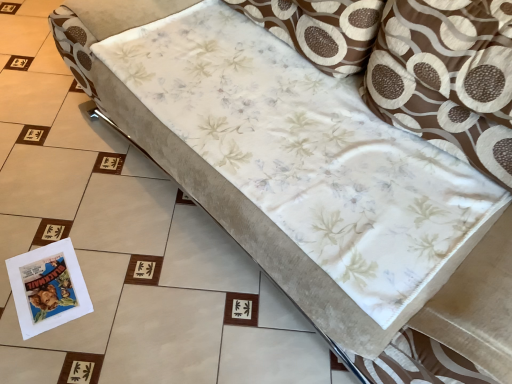
Describe the element at coordinates (447, 78) in the screenshot. I see `floral fabric pillow at upper right` at that location.

Measure the distance between floral fabric pillow at upper right and camera.

floral fabric pillow at upper right and camera are 1.08 meters apart.

You are a GUI agent. You are given a task and a screenshot of the screen. Output one action in this format:
    pyautogui.click(x=<x>, y=<y>)
    Task: Click on the floral fabric pillow at upper right
    The image size is (512, 384).
    Given the screenshot: What is the action you would take?
    pyautogui.click(x=447, y=78)

The image size is (512, 384). Identify the location of brown textured pillow at upper right. (320, 29).

What do you see at coordinates (320, 29) in the screenshot? This screenshot has width=512, height=384. I see `brown textured pillow at upper right` at bounding box center [320, 29].

You are a GUI agent. You are given a task and a screenshot of the screen. Output one action in this format:
    pyautogui.click(x=<x>, y=<y>)
    Task: Click on the floral fabric pillow at upper right
    The width and height of the screenshot is (512, 384).
    Given the screenshot: What is the action you would take?
    pyautogui.click(x=447, y=78)

Based on their positions, is brown textured pillow at upper right located to the left or right of floral fabric pillow at upper right?

Based on their positions, brown textured pillow at upper right is located to the left of floral fabric pillow at upper right.

Is brown textured pillow at upper right positioned in front of floral fabric pillow at upper right?

No, it is not.

Considering the points (342, 45) and (406, 57), which point is in front, point (342, 45) or point (406, 57)?

Positioned in front is point (406, 57).

Consider the image. From the image's perspective, between brown textured pillow at upper right and floral fabric pillow at upper right, which one is located above?

brown textured pillow at upper right, from the image's perspective.

From a real-world perspective, relative to floral fabric pillow at upper right, is brown textured pillow at upper right vertically above or below?

Clearly, from a real-world perspective, brown textured pillow at upper right is below floral fabric pillow at upper right.

Which of these two, brown textured pillow at upper right or floral fabric pillow at upper right, is thinner?

Thinner between the two is brown textured pillow at upper right.

Does brown textured pillow at upper right have a greater height compared to floral fabric pillow at upper right?

In fact, brown textured pillow at upper right may be shorter than floral fabric pillow at upper right.

Considering the sizes of objects brown textured pillow at upper right and floral fabric pillow at upper right in the image provided, who is bigger, brown textured pillow at upper right or floral fabric pillow at upper right?

floral fabric pillow at upper right.

Is brown textured pillow at upper right outside of floral fabric pillow at upper right?

Yes, brown textured pillow at upper right is located beyond the bounds of floral fabric pillow at upper right.

Is brown textured pillow at upper right far away from floral fabric pillow at upper right?

brown textured pillow at upper right is actually quite close to floral fabric pillow at upper right.

Is brown textured pillow at upper right positioned with its back to floral fabric pillow at upper right?

brown textured pillow at upper right is not turned away from floral fabric pillow at upper right.

Image resolution: width=512 pixels, height=384 pixels. I want to click on throw pillow in front of the brown textured pillow at upper right, so click(x=447, y=78).

Which is more to the right, floral fabric pillow at upper right or brown textured pillow at upper right?

From the viewer's perspective, floral fabric pillow at upper right appears more on the right side.

Does floral fabric pillow at upper right come in front of brown textured pillow at upper right?

Yes, floral fabric pillow at upper right is in front of brown textured pillow at upper right.

Is point (472, 74) positioned before point (307, 37)?

That is True.

From the image's perspective, is floral fabric pillow at upper right over brown textured pillow at upper right?

Actually, floral fabric pillow at upper right appears below brown textured pillow at upper right in the image.

From a real-world perspective, is floral fabric pillow at upper right positioned under brown textured pillow at upper right based on gravity?

Incorrect, from a real-world perspective, floral fabric pillow at upper right is higher than brown textured pillow at upper right.

Considering the relative sizes of floral fabric pillow at upper right and brown textured pillow at upper right in the image provided, is floral fabric pillow at upper right thinner than brown textured pillow at upper right?

No, floral fabric pillow at upper right is not thinner than brown textured pillow at upper right.

Considering the relative sizes of floral fabric pillow at upper right and brown textured pillow at upper right in the image provided, is floral fabric pillow at upper right taller than brown textured pillow at upper right?

Yes, floral fabric pillow at upper right is taller than brown textured pillow at upper right.

Who is bigger, floral fabric pillow at upper right or brown textured pillow at upper right?

floral fabric pillow at upper right is bigger.

Is brown textured pillow at upper right inside floral fabric pillow at upper right?

No.

From the picture: Can you see floral fabric pillow at upper right touching brown textured pillow at upper right?

floral fabric pillow at upper right and brown textured pillow at upper right are clearly separated.

Is floral fabric pillow at upper right turned away from brown textured pillow at upper right?

No, floral fabric pillow at upper right is not facing away from brown textured pillow at upper right.

You are a GUI agent. You are given a task and a screenshot of the screen. Output one action in this format:
    pyautogui.click(x=<x>, y=<y>)
    Task: Click on the pillow located on the left of floral fabric pillow at upper right
    The width and height of the screenshot is (512, 384).
    Given the screenshot: What is the action you would take?
    pyautogui.click(x=320, y=29)

The image size is (512, 384). I want to click on pillow that is behind the floral fabric pillow at upper right, so click(x=320, y=29).

This screenshot has height=384, width=512. I want to click on pillow lying on the left of floral fabric pillow at upper right, so click(x=320, y=29).